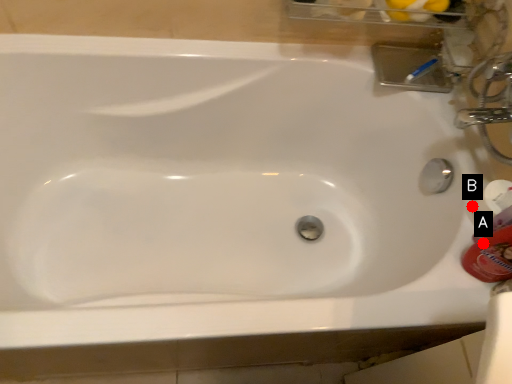
Question: Two points are circled on the image, labeled by A and B beside each circle. Which point is closer to the camera?

Choices:
 (A) A is closer
 (B) B is closer

Answer: (A)